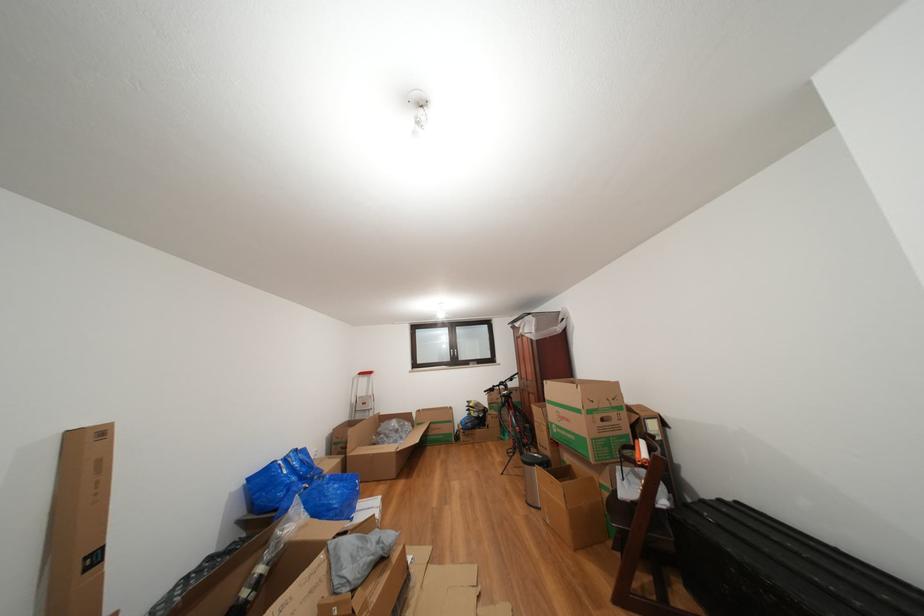
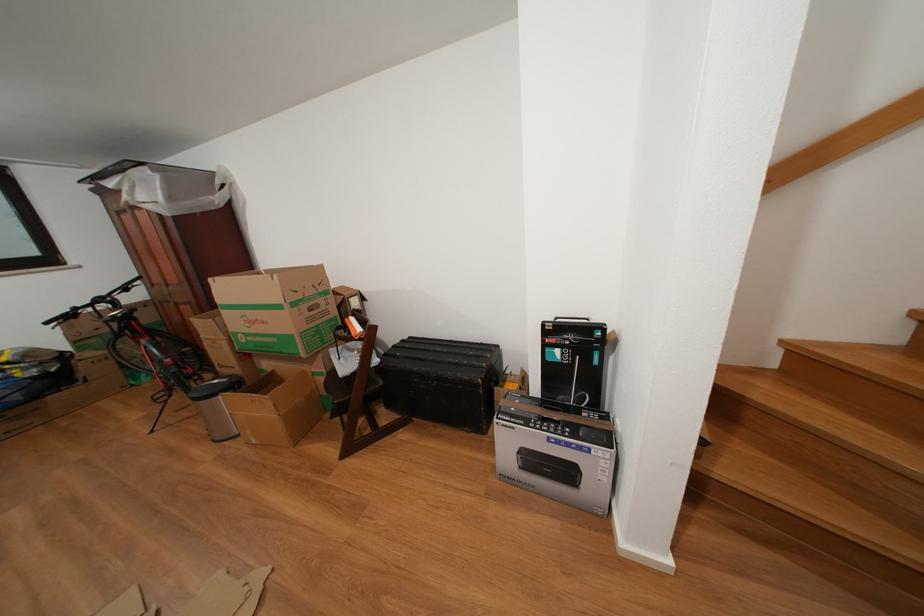
In the second image, find the point that corresponds to [517,415] in the first image.

(143, 344)